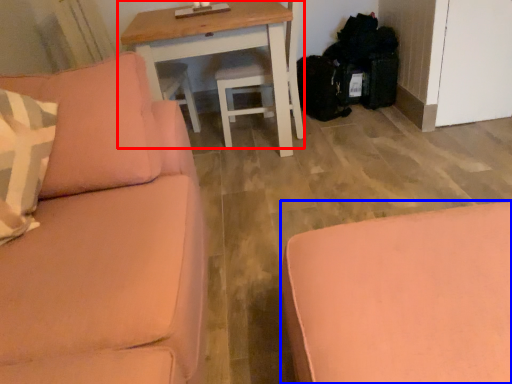
Question: Among these objects, which one is farthest to the camera, table (highlighted by a red box) or studio couch (highlighted by a blue box)?

Choices:
 (A) table
 (B) studio couch

Answer: (A)